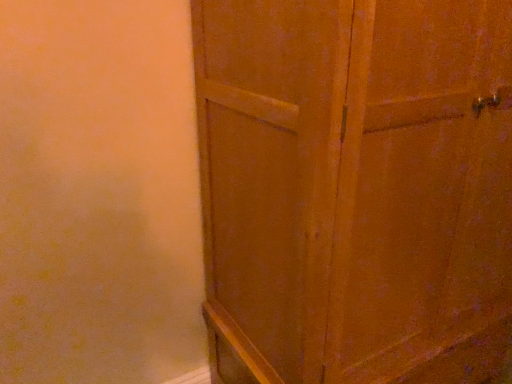
Identify the location of wooden cabinet at right. (356, 189).

Describe the element at coordinates (356, 189) in the screenshot. The width and height of the screenshot is (512, 384). I see `wooden cabinet at right` at that location.

In order to click on wooden cabinet at right in this screenshot , I will do `click(356, 189)`.